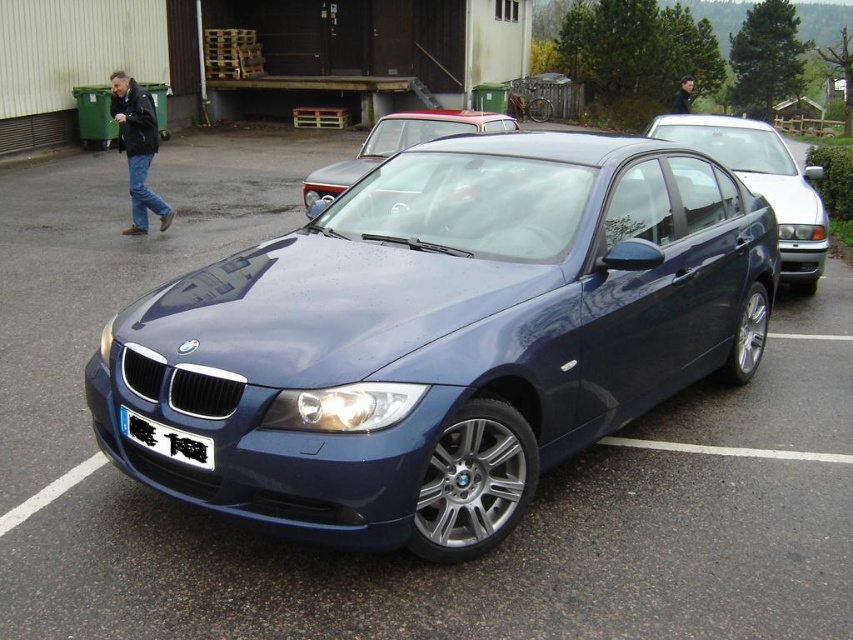
You are a parking attendant who needs to fit both the satin blue sedan at right and the glossy metallic car at center into a single parking spot that can only accommodate one car. Which car would you choose to park in the spot to ensure it fits without overlapping?

The satin blue sedan at right has a smaller size compared to the glossy metallic car at center, so it would fit better in the parking spot designed for one car.

You are a parking attendant who needs to move the satin blue car at center and the glossy metallic car at center. Which car should you move first to allow both to exit easily?

The satin blue car at center is in front of the glossy metallic car at center, so you should move the satin blue car at center first to allow the glossy metallic car at center to exit freely.

You are a delivery person needing to move a box from the glossy metallic car at center to the wooden door. The box is 10 feet long. Can you move it without tilting it sideways?

The distance between the glossy metallic car at center and the wooden door is 26.84 feet. Since the box is only 10 feet long, there is enough space to move it without tilting sideways.